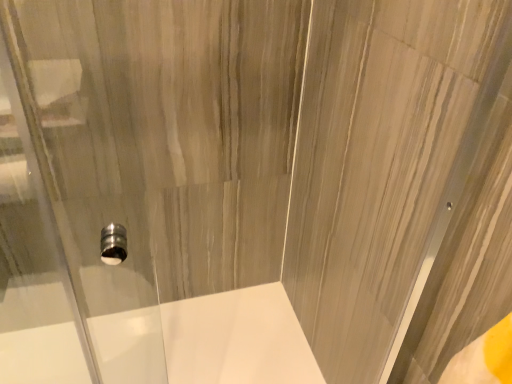
What do you see at coordinates (207, 341) in the screenshot? I see `white glossy bath at lower left` at bounding box center [207, 341].

At what (x,y) coordinates should I click in order to perform the action: click on white glossy bath at lower left. Please return your answer as a coordinate pair (x, y). Looking at the image, I should click on (207, 341).

Identify the location of white glossy bath at lower left. (207, 341).